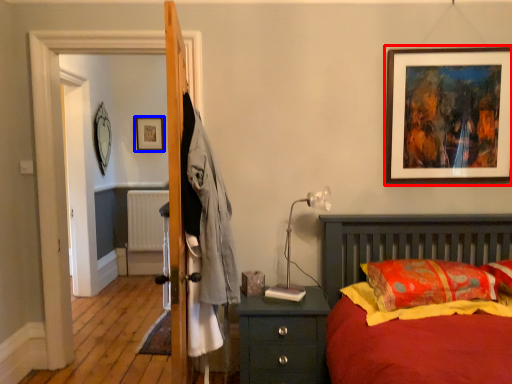
Question: Which point is closer to the camera, picture frame (highlighted by a red box) or picture frame (highlighted by a blue box)?

Choices:
 (A) picture frame
 (B) picture frame

Answer: (A)